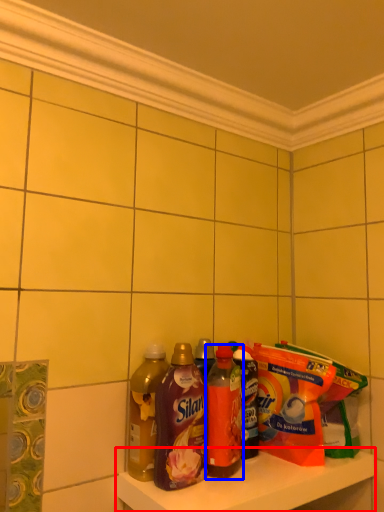
Question: Among these objects, which one is nearest to the camera, shelf (highlighted by a red box) or bottle (highlighted by a blue box)?

Choices:
 (A) shelf
 (B) bottle

Answer: (A)